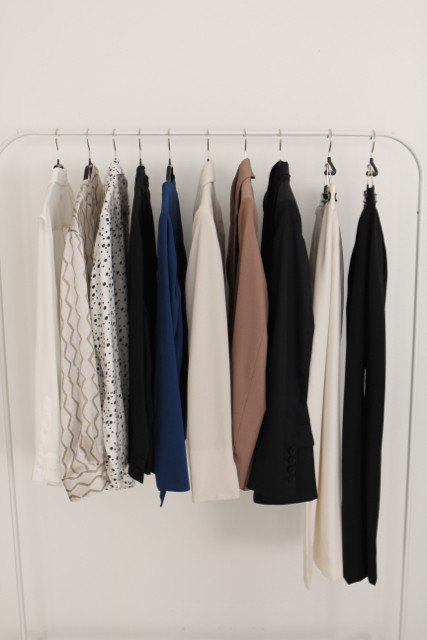
I want to click on clothes hangers, so click(368, 168), click(326, 156), click(279, 148), click(244, 145), click(207, 145), click(168, 148), click(141, 152), click(117, 152), click(88, 148), click(58, 148).